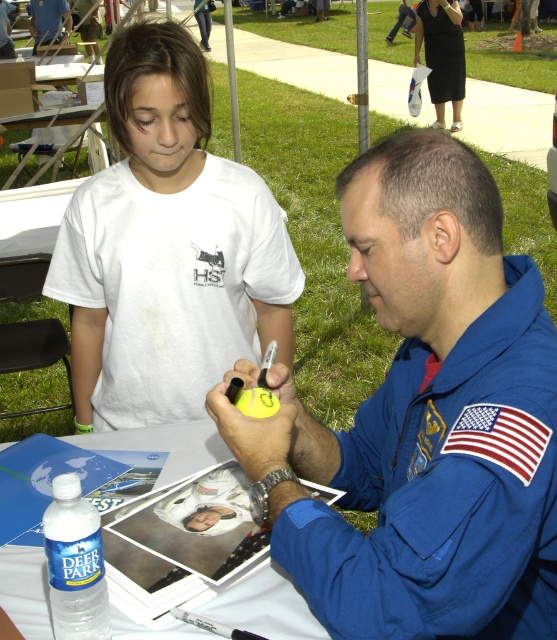
Describe the element at coordinates (423, 419) in the screenshot. I see `blue fabric astronaut suit at center` at that location.

Can you confirm if blue fabric astronaut suit at center is positioned to the left of white paper at center?

In fact, blue fabric astronaut suit at center is to the right of white paper at center.

Who is more distant from viewer, (509,292) or (40,550)?

The point (40,550) is more distant.

This screenshot has width=557, height=640. I want to click on blue fabric astronaut suit at center, so click(x=423, y=419).

Consider the image. Is white cotton shirt at upper left positioned in front of blue space suit at center?

Yes, it is.

Is white cotton shirt at upper left thinner than blue space suit at center?

Yes, white cotton shirt at upper left is thinner than blue space suit at center.

Is point (100, 346) less distant than point (55, 8)?

Yes, it is.

At what (x,y) coordinates should I click in order to perform the action: click on white cotton shirt at upper left. Please return your answer as a coordinate pair (x, y). The height and width of the screenshot is (640, 557). Looking at the image, I should click on (167, 248).

Can you confirm if white cotton shirt at upper left is positioned to the left of white paper at center?

Incorrect, white cotton shirt at upper left is not on the left side of white paper at center.

From the picture: Who is higher up, white cotton shirt at upper left or white paper at center?

Positioned higher is white cotton shirt at upper left.

Does point (121, 332) come farther from viewer compared to point (21, 560)?

Yes, point (121, 332) is behind point (21, 560).

In order to click on white cotton shirt at upper left in this screenshot , I will do `click(167, 248)`.